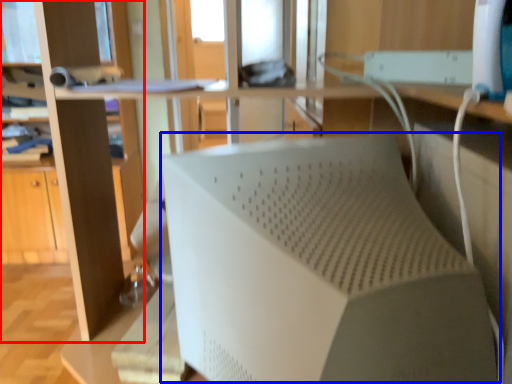
Question: Which object appears farthest to the camera in this image, bookshelf (highlighted by a red box) or wide (highlighted by a blue box)?

Choices:
 (A) bookshelf
 (B) wide

Answer: (A)